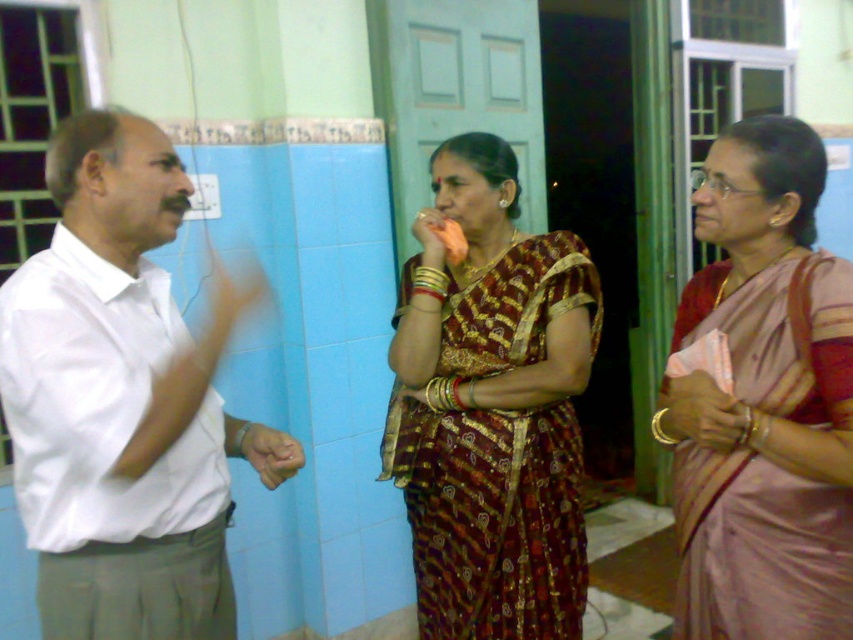
Does white cotton shirt at left have a lesser width compared to pink silk saree at center?

No, white cotton shirt at left is not thinner than pink silk saree at center.

Can you confirm if white cotton shirt at left is smaller than pink silk saree at center?

No.

Between point (146, 532) and point (718, 577), which one is positioned behind?

Positioned behind is point (718, 577).

The width and height of the screenshot is (853, 640). In order to click on white cotton shirt at left in this screenshot , I will do `click(125, 401)`.

Which is behind, point (161, 486) or point (419, 304)?

The point (419, 304) is behind.

Is white cotton shirt at left to the right of maroon silk saree at center from the viewer's perspective?

No, white cotton shirt at left is not to the right of maroon silk saree at center.

Is point (9, 316) in front of point (544, 337)?

Yes.

Find the location of a particular element. The image size is (853, 640). white cotton shirt at left is located at coordinates (125, 401).

Is pink silk saree at center above maroon silk saree at center?

Yes.

Between pink silk saree at center and maroon silk saree at center, which one is positioned higher?

Positioned higher is pink silk saree at center.

Between point (849, 522) and point (399, 465), which one is positioned behind?

The point (399, 465) is behind.

Find the location of a particular element. pink silk saree at center is located at coordinates (762, 401).